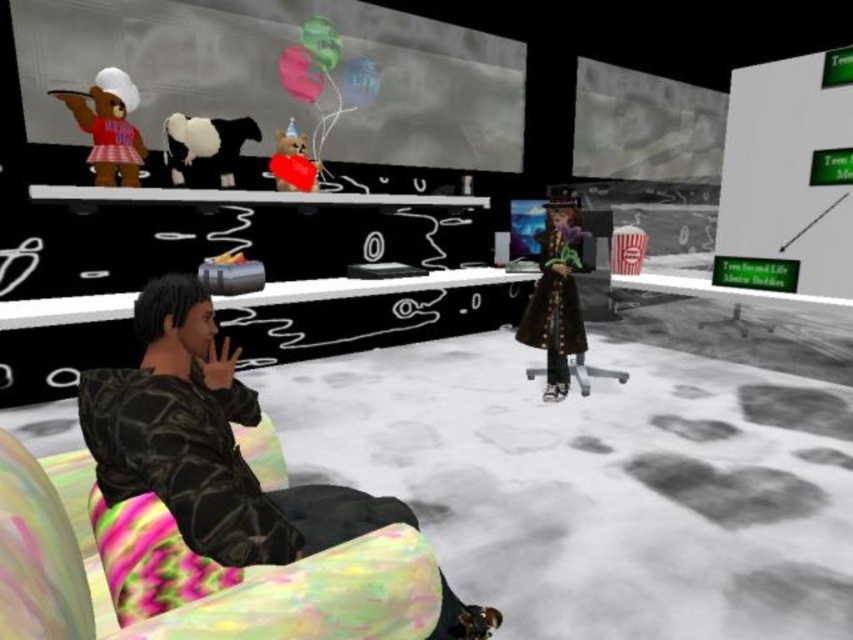
Question: Can you confirm if camouflage jacket at left is wider than velvet brown coat at center?

Choices:
 (A) yes
 (B) no

Answer: (A)

Question: Can you confirm if camouflage jacket at left is bigger than velvet brown coat at center?

Choices:
 (A) yes
 (B) no

Answer: (B)

Question: Which object appears farthest from the camera in this image?

Choices:
 (A) camouflage jacket at left
 (B) velvet brown coat at center

Answer: (B)

Question: Does camouflage jacket at left have a smaller size compared to velvet brown coat at center?

Choices:
 (A) yes
 (B) no

Answer: (A)

Question: Which point appears closest to the camera in this image?

Choices:
 (A) (556, 314)
 (B) (155, 550)

Answer: (B)